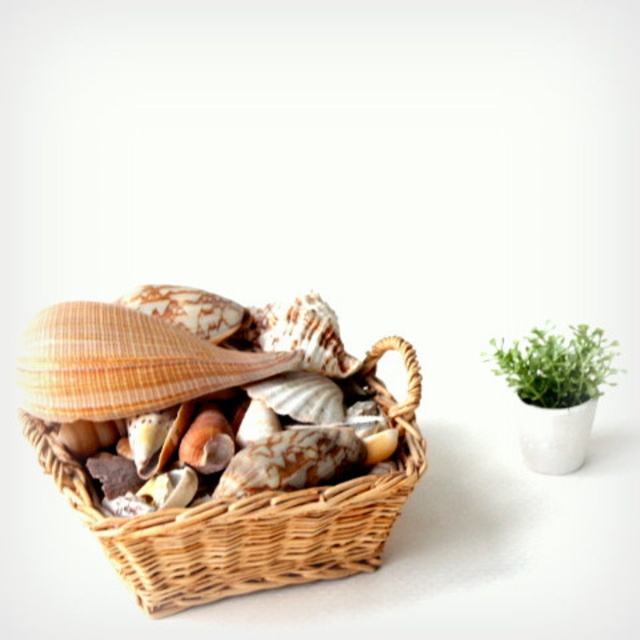
Question: Does woven wood basket at left have a lesser width compared to orange striped seashell at center?

Choices:
 (A) no
 (B) yes

Answer: (A)

Question: Observing the image, what is the correct spatial positioning of orange striped seashell at center in reference to green leafy plant in pot at right?

Choices:
 (A) right
 (B) left

Answer: (B)

Question: Which point is farther to the camera?

Choices:
 (A) (205, 362)
 (B) (573, 380)
 (C) (269, 580)

Answer: (B)

Question: Which point is farther to the camera?

Choices:
 (A) woven wood basket at left
 (B) green leafy plant in pot at right
 (C) orange striped seashell at center

Answer: (B)

Question: Is orange striped seashell at center further to camera compared to green leafy plant in pot at right?

Choices:
 (A) yes
 (B) no

Answer: (B)

Question: Which point is closer to the camera taking this photo?

Choices:
 (A) (563, 374)
 (B) (40, 445)
 (C) (61, 369)

Answer: (C)